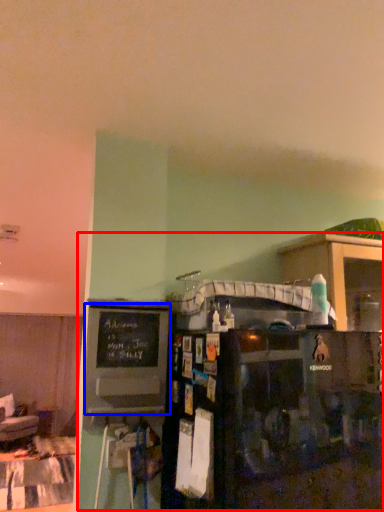
Question: Which of the following is the farthest to the observer, entertainment center (highlighted by a red box) or bulletin board (highlighted by a blue box)?

Choices:
 (A) entertainment center
 (B) bulletin board

Answer: (B)